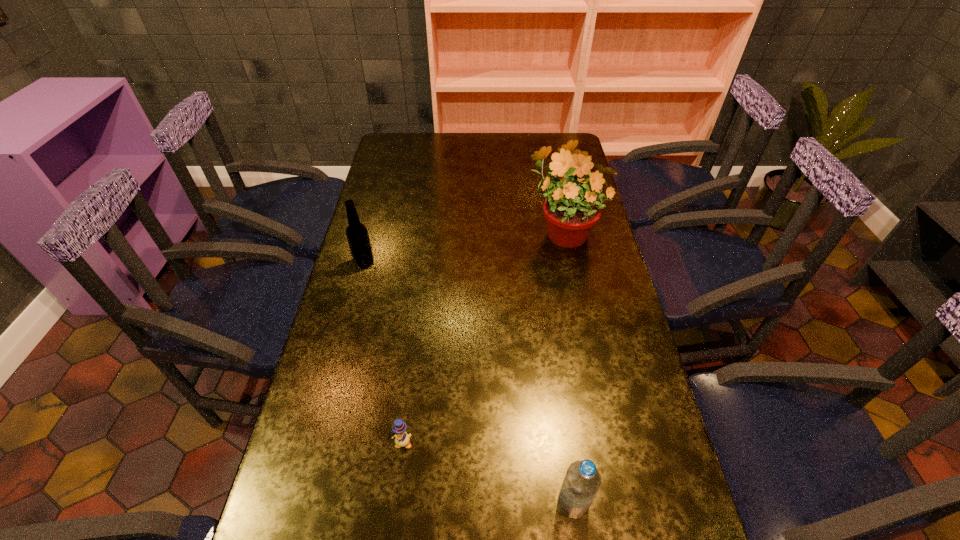
Locate an element on the screen. The height and width of the screenshot is (540, 960). free space that satisfies the following two spatial constraints: 1. on the face of the third tallest object, where the monocle is placed; 2. on the left side of the shortest object is located at coordinates (396, 503).

The height and width of the screenshot is (540, 960). I want to click on vacant region that satisfies the following two spatial constraints: 1. on the face of the shortest object, where the monocle is placed; 2. on the left side of the nearest object, so click(x=396, y=503).